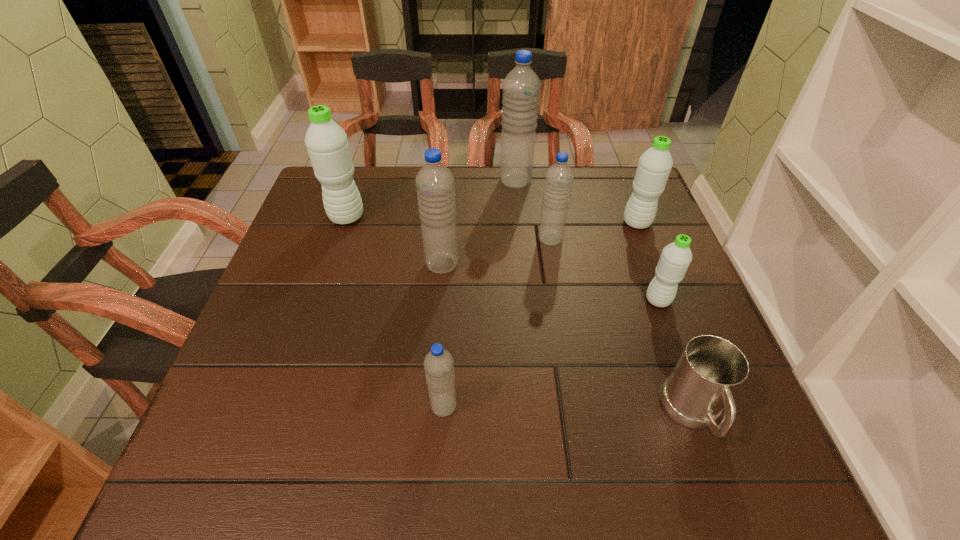
In the image, there is a desktop. At what (x,y) coordinates should I click in order to perform the action: click on free space at the right edge. Please return your answer as a coordinate pair (x, y). This screenshot has height=540, width=960. Looking at the image, I should click on (614, 244).

This screenshot has height=540, width=960. Identify the location of free location at the far left corner. (363, 194).

Locate an element on the screen. This screenshot has width=960, height=540. empty location between the fifth farthest object and the leftmost green water bottle is located at coordinates (395, 241).

This screenshot has width=960, height=540. Identify the location of free area in between the second farthest blue water bottle and the nearest blue water bottle. (497, 322).

You are a GUI agent. You are given a task and a screenshot of the screen. Output one action in this format:
    pyautogui.click(x=<x>, y=<y>)
    Task: Click on the vacant area between the smallest blue water bottle and the nearest green water bottle
    The image size is (960, 540).
    Given the screenshot: What is the action you would take?
    pyautogui.click(x=551, y=353)

Locate an element on the screen. empty location between the fifth farthest object and the second biggest green water bottle is located at coordinates (540, 244).

This screenshot has height=540, width=960. In order to click on blank region between the nearest blue water bottle and the second smallest blue water bottle in this screenshot , I will do `click(497, 322)`.

This screenshot has width=960, height=540. What are the coordinates of `vacant point located between the farthest object and the third nearest blue water bottle` in the screenshot? It's located at (533, 210).

This screenshot has width=960, height=540. I want to click on vacant space in between the sixth farthest object and the nearest blue water bottle, so click(551, 353).

The image size is (960, 540). In order to click on unoccupied position between the tallest water bottle and the nearest water bottle in this screenshot , I will do `click(480, 294)`.